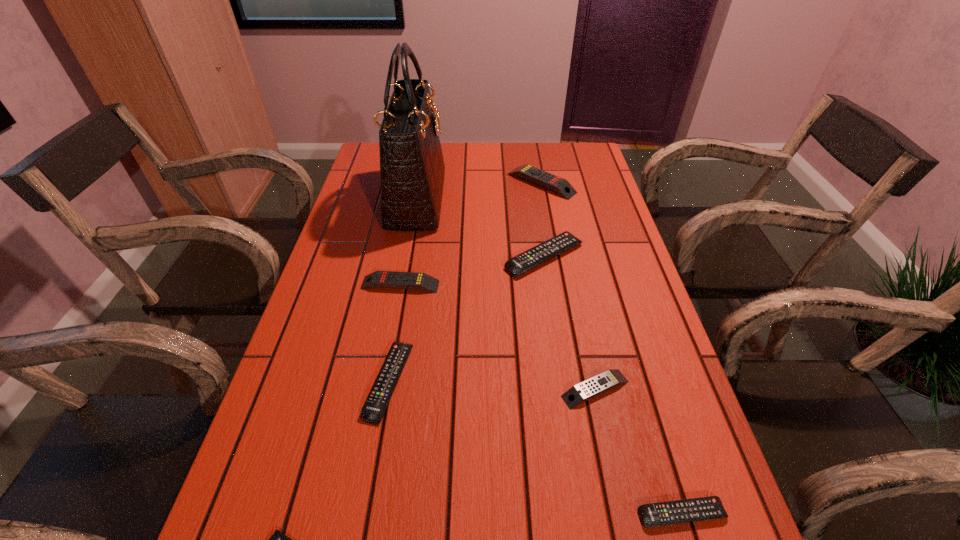
Identify the location of free space between the leftmost yellow remote control and the second nearest black remote control. Image resolution: width=960 pixels, height=540 pixels. pyautogui.click(x=395, y=333).

Where is `free space between the tallest object and the biggest black remote control`? free space between the tallest object and the biggest black remote control is located at coordinates (480, 228).

Where is `free point between the nearest yellow remote control and the biggest black remote control`? free point between the nearest yellow remote control and the biggest black remote control is located at coordinates (569, 323).

I want to click on blank region between the handbag and the second biggest black remote control, so click(403, 291).

Where is `object that stands as the closest to the tallest object`? object that stands as the closest to the tallest object is located at coordinates (382, 279).

Find the location of a particular element. The width and height of the screenshot is (960, 540). the closest object relative to the handbag is located at coordinates (382, 279).

The width and height of the screenshot is (960, 540). I want to click on remote control that is the fourth closest to the second smallest yellow remote control, so click(557, 184).

Where is `remote control object that ranks as the second closest to the nearest yellow remote control`? The image size is (960, 540). remote control object that ranks as the second closest to the nearest yellow remote control is located at coordinates (527, 260).

Find the location of a particular element. the second closest yellow remote control to the second biggest yellow remote control is located at coordinates (557, 184).

At what (x,y) coordinates should I click in order to perform the action: click on yellow remote control identified as the second closest to the leftmost yellow remote control. Please return your answer as a coordinate pair (x, y). Looking at the image, I should click on (557, 184).